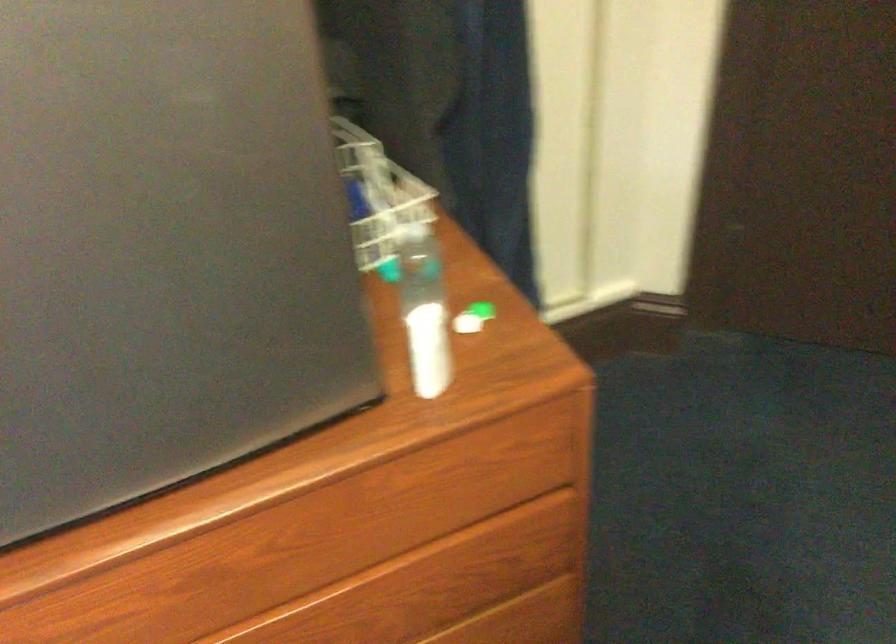
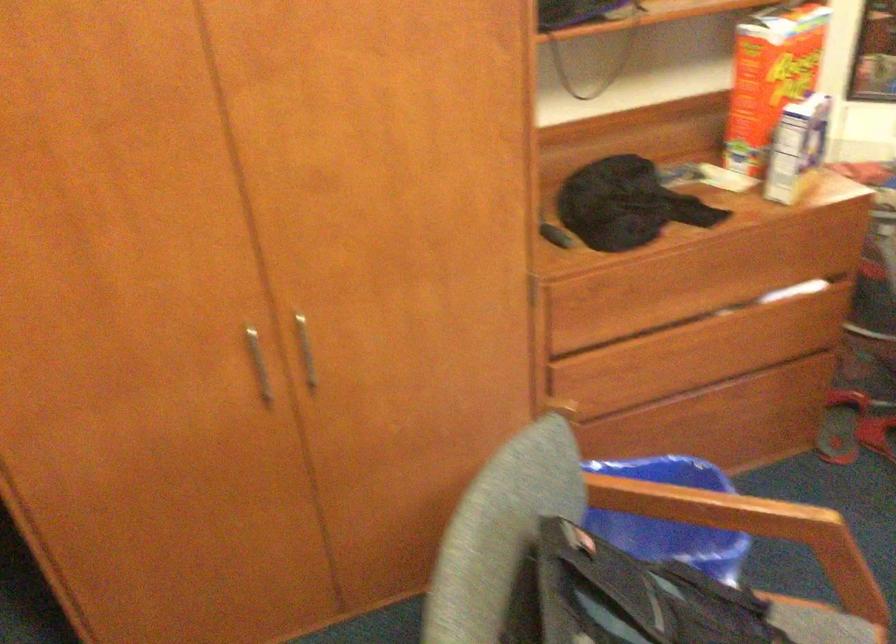
The images are taken continuously from a first-person perspective. In which direction is your viewpoint rotating?

The rotation direction of the camera is right-down.